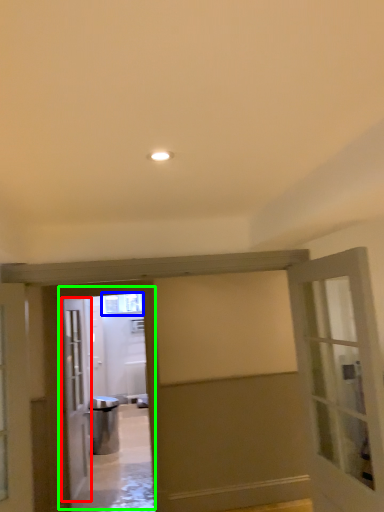
Question: Considering the real-world distances, which object is closest to door (highlighted by a red box)? window (highlighted by a blue box) or elevator (highlighted by a green box).

Choices:
 (A) window
 (B) elevator

Answer: (B)